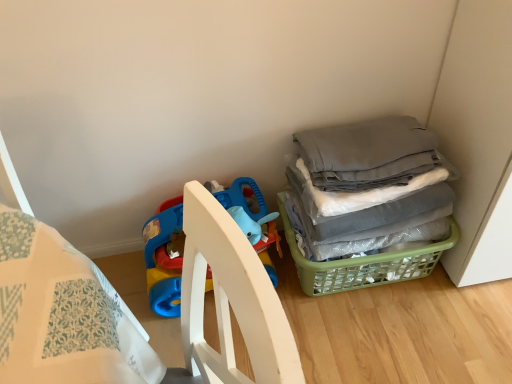
Question: Is gray fabric at right positioned with its back to plastic blue playpen at lower left?

Choices:
 (A) yes
 (B) no

Answer: (B)

Question: Considering the relative sizes of gray fabric at right and plastic blue playpen at lower left in the image provided, is gray fabric at right thinner than plastic blue playpen at lower left?

Choices:
 (A) no
 (B) yes

Answer: (A)

Question: From the image's perspective, is gray fabric at right on plastic blue playpen at lower left?

Choices:
 (A) no
 (B) yes

Answer: (B)

Question: From a real-world perspective, is gray fabric at right located higher than plastic blue playpen at lower left?

Choices:
 (A) no
 (B) yes

Answer: (B)

Question: Does gray fabric at right have a greater width compared to plastic blue playpen at lower left?

Choices:
 (A) no
 (B) yes

Answer: (B)

Question: Is point (209, 286) closer or farther from the camera than point (294, 172)?

Choices:
 (A) farther
 (B) closer

Answer: (B)

Question: Looking at their shapes, would you say plastic blue playpen at lower left is wider or thinner than gray fabric at right?

Choices:
 (A) thin
 (B) wide

Answer: (A)

Question: From a real-world perspective, relative to gray fabric at right, is plastic blue playpen at lower left vertically above or below?

Choices:
 (A) below
 (B) above

Answer: (A)

Question: Considering their positions, is plastic blue playpen at lower left located in front of or behind gray fabric at right?

Choices:
 (A) behind
 (B) front

Answer: (A)

Question: Considering their positions, is green plastic basket at lower right located in front of or behind plastic blue playpen at lower left?

Choices:
 (A) front
 (B) behind

Answer: (B)

Question: From a real-world perspective, is green plastic basket at lower right physically located above or below plastic blue playpen at lower left?

Choices:
 (A) above
 (B) below

Answer: (B)

Question: From the image's perspective, relative to plastic blue playpen at lower left, is green plastic basket at lower right above or below?

Choices:
 (A) below
 (B) above

Answer: (A)

Question: Is point (285, 233) closer or farther from the camera than point (228, 190)?

Choices:
 (A) closer
 (B) farther

Answer: (B)

Question: From the image's perspective, is gray fabric at right located above or below green plastic basket at lower right?

Choices:
 (A) below
 (B) above

Answer: (B)

Question: In terms of width, does gray fabric at right look wider or thinner when compared to green plastic basket at lower right?

Choices:
 (A) thin
 (B) wide

Answer: (A)